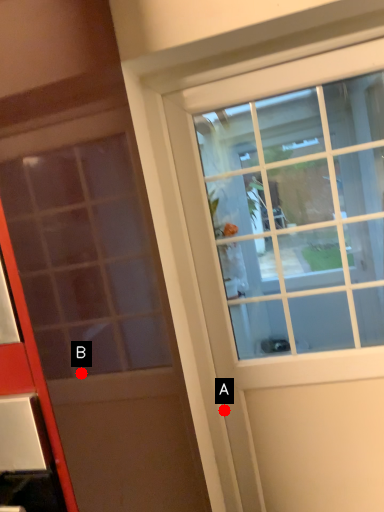
Question: Two points are circled on the image, labeled by A and B beside each circle. Which point is farther from the camera taking this photo?

Choices:
 (A) A is further
 (B) B is further

Answer: (A)